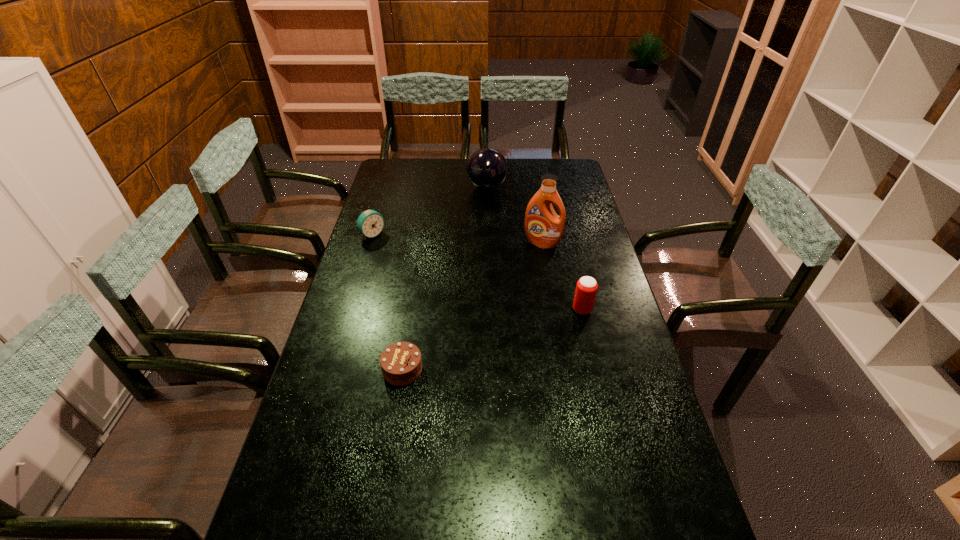
In order to click on vacant space on the desktop that is between the second object from left to right and the second nearest object and is positioned on the side of the bowling ball with the finger holes in this screenshot , I will do `click(490, 341)`.

At what (x,y) coordinates should I click in order to perform the action: click on free space on the desktop that is between the nearest object and the second nearest object and is positioned on the front-facing side of the alarm clock. Please return your answer as a coordinate pair (x, y). Looking at the image, I should click on (513, 333).

Where is `free spot on the desktop that is between the shortest object and the fourth farthest object and is positioned on the front-facing side of the detergent`? This screenshot has height=540, width=960. free spot on the desktop that is between the shortest object and the fourth farthest object and is positioned on the front-facing side of the detergent is located at coordinates (504, 336).